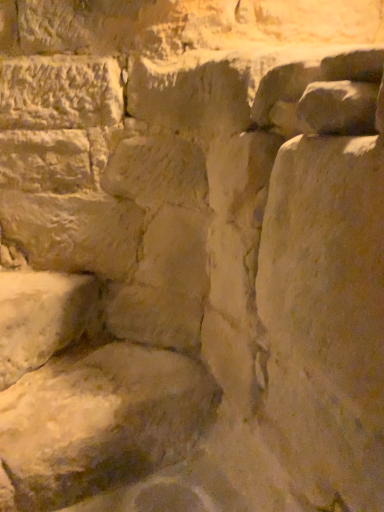
The image size is (384, 512). Find the location of `smooth beige rock at lower left`. smooth beige rock at lower left is located at coordinates (40, 318).

Describe the element at coordinates (40, 318) in the screenshot. I see `smooth beige rock at lower left` at that location.

Identify the location of smooth beige rock at lower left. (40, 318).